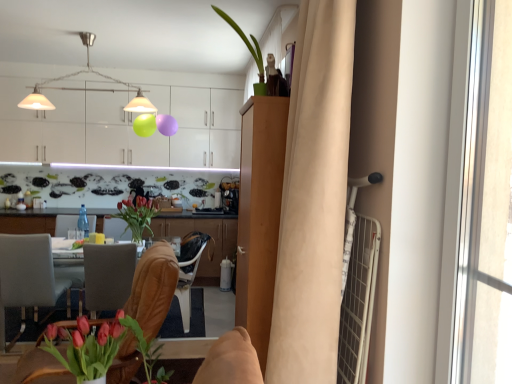
Question: Is metallic pendant lights at upper center thinner than green matte plant at upper center?

Choices:
 (A) no
 (B) yes

Answer: (A)

Question: From a real-world perspective, is metallic pendant lights at upper center physically above green matte plant at upper center?

Choices:
 (A) yes
 (B) no

Answer: (A)

Question: Can you confirm if metallic pendant lights at upper center is shorter than green matte plant at upper center?

Choices:
 (A) no
 (B) yes

Answer: (A)

Question: Is metallic pendant lights at upper center positioned with its back to green matte plant at upper center?

Choices:
 (A) yes
 (B) no

Answer: (B)

Question: Is the position of metallic pendant lights at upper center less distant than that of green matte plant at upper center?

Choices:
 (A) yes
 (B) no

Answer: (B)

Question: Is metallic pendant lights at upper center facing towards green matte plant at upper center?

Choices:
 (A) yes
 (B) no

Answer: (A)

Question: From a real-world perspective, is clear glass bottle at center positioned under leather at center, which ranks as the 1th chair in right-to-left order, based on gravity?

Choices:
 (A) yes
 (B) no

Answer: (B)

Question: Can you confirm if clear glass bottle at center is wider than leather at center, the second chair viewed from the left?

Choices:
 (A) no
 (B) yes

Answer: (A)

Question: From the image's perspective, would you say clear glass bottle at center is positioned over leather at center, which ranks as the 1th chair in right-to-left order?

Choices:
 (A) no
 (B) yes

Answer: (B)

Question: Can you confirm if clear glass bottle at center is shorter than leather at center, the second chair viewed from the left?

Choices:
 (A) yes
 (B) no

Answer: (A)

Question: From a real-world perspective, is clear glass bottle at center located higher than leather at center, which ranks as the second chair in back-to-front order?

Choices:
 (A) no
 (B) yes

Answer: (B)

Question: Considering the relative positions of clear glass bottle at center and leather at center, the second chair viewed from the left, in the image provided, is clear glass bottle at center to the left of leather at center, the second chair viewed from the left, from the viewer's perspective?

Choices:
 (A) yes
 (B) no

Answer: (A)

Question: Considering the relative sizes of matte pink tulips in vase at lower left, positioned as the 2th floral arrangement in left-to-right order, and white glossy cabinets at upper center, the third cabinetry in the front-to-back sequence, in the image provided, is matte pink tulips in vase at lower left, positioned as the 2th floral arrangement in left-to-right order, taller than white glossy cabinets at upper center, the third cabinetry in the front-to-back sequence,?

Choices:
 (A) yes
 (B) no

Answer: (B)